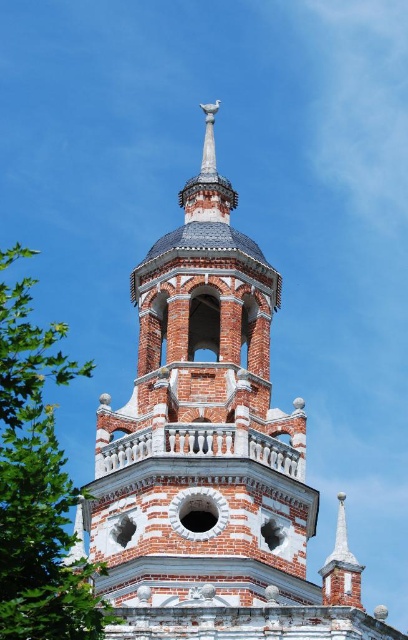
Based on the photo, can you confirm if red brick tower at center is positioned below green leafy tree at left?

Yes.

Is red brick tower at center in front of green leafy tree at left?

No, it is not.

This screenshot has width=408, height=640. I want to click on red brick tower at center, so click(x=210, y=456).

At what (x,y) coordinates should I click in order to perform the action: click on red brick tower at center. Please return your answer as a coordinate pair (x, y). Looking at the image, I should click on (210, 456).